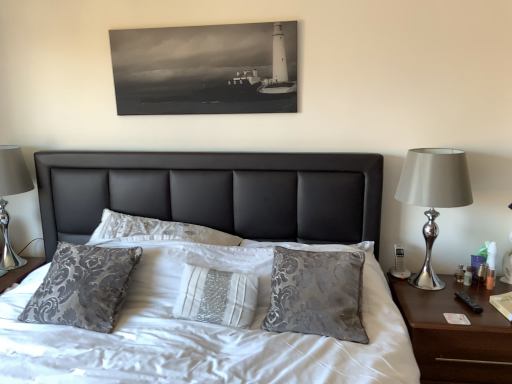
I want to click on free space in front of silver metallic lamp at right, so click(x=449, y=314).